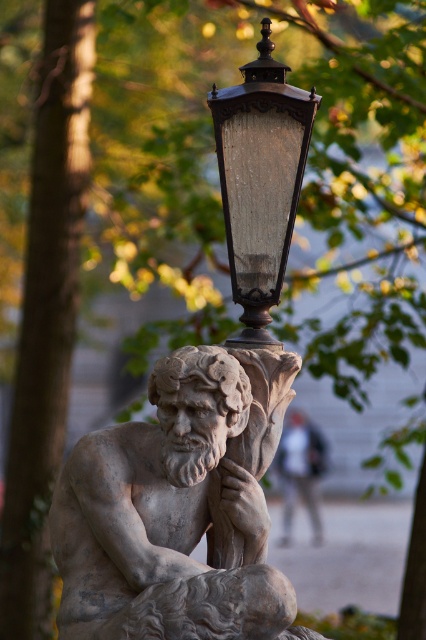
Who is taller, stone statue at center or wooden textured lantern at upper center?

wooden textured lantern at upper center is taller.

Looking at this image, which is more to the right, stone statue at center or wooden textured lantern at upper center?

wooden textured lantern at upper center

Describe the element at coordinates (176, 509) in the screenshot. I see `stone statue at center` at that location.

At what (x,y) coordinates should I click in order to perform the action: click on stone statue at center. Please return your answer as a coordinate pair (x, y). Looking at the image, I should click on (176, 509).